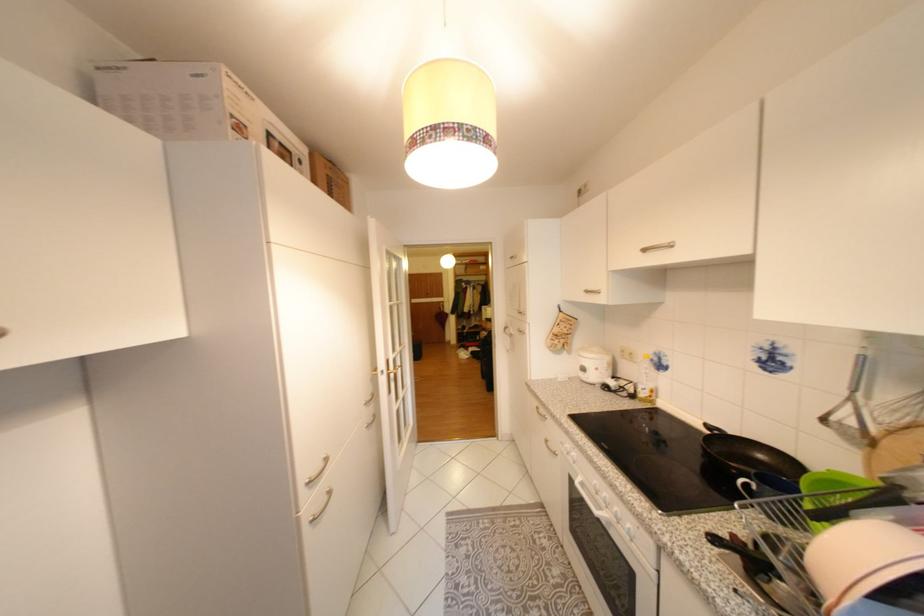
Identify the location of straight cabinet handle. This screenshot has width=924, height=616. (658, 246).